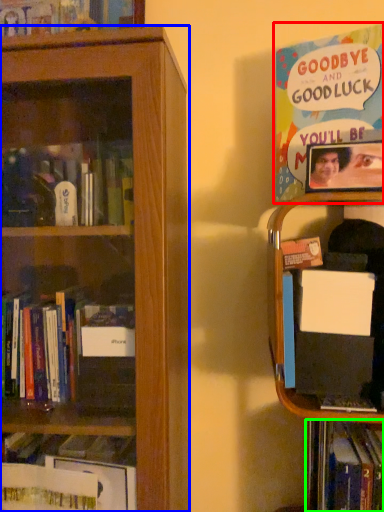
Question: Estimate the real-world distances between objects in this image. Which object is farther from book (highlighted by a red box), bookcase (highlighted by a blue box) or book (highlighted by a green box)?

Choices:
 (A) bookcase
 (B) book

Answer: (B)